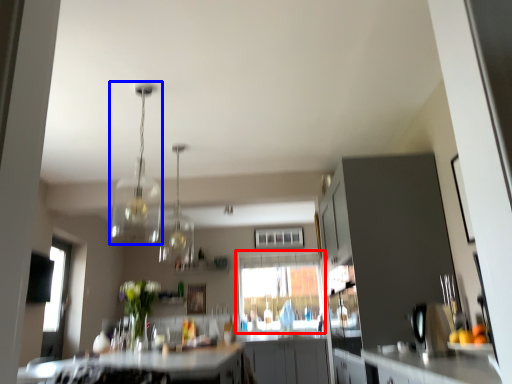
Question: Which object is closer to the camera taking this photo, window (highlighted by a red box) or light fixture (highlighted by a blue box)?

Choices:
 (A) window
 (B) light fixture

Answer: (B)